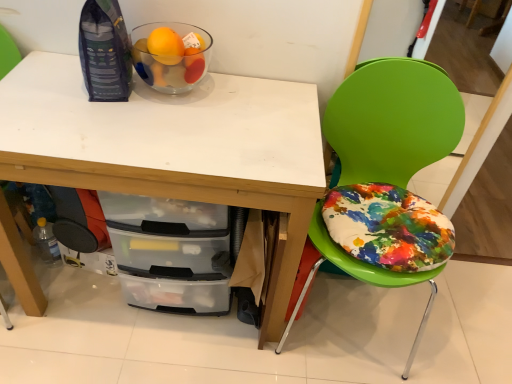
Question: Are clear plastic bottle at lower left and transparent glass bowl at upper left beside each other?

Choices:
 (A) no
 (B) yes

Answer: (A)

Question: From a real-world perspective, is clear plastic bottle at lower left physically above transparent glass bowl at upper left?

Choices:
 (A) no
 (B) yes

Answer: (A)

Question: Is clear plastic bottle at lower left surrounding transparent glass bowl at upper left?

Choices:
 (A) no
 (B) yes

Answer: (A)

Question: Could you tell me if clear plastic bottle at lower left is turned towards transparent glass bowl at upper left?

Choices:
 (A) no
 (B) yes

Answer: (A)

Question: Does clear plastic bottle at lower left have a lesser height compared to transparent glass bowl at upper left?

Choices:
 (A) no
 (B) yes

Answer: (A)

Question: From the image's perspective, is clear plastic bottle at lower left positioned above or below green plastic chair at right?

Choices:
 (A) below
 (B) above

Answer: (A)

Question: Is clear plastic bottle at lower left taller or shorter than green plastic chair at right?

Choices:
 (A) tall
 (B) short

Answer: (B)

Question: Based on their positions, is clear plastic bottle at lower left located to the left or right of green plastic chair at right?

Choices:
 (A) right
 (B) left

Answer: (B)

Question: Considering their positions, is clear plastic bottle at lower left located in front of or behind green plastic chair at right?

Choices:
 (A) behind
 (B) front

Answer: (A)

Question: Is green plastic chair at right spatially inside clear plastic bottle at lower left, or outside of it?

Choices:
 (A) outside
 (B) inside

Answer: (A)

Question: From a real-world perspective, is green plastic chair at right physically located above or below clear plastic bottle at lower left?

Choices:
 (A) above
 (B) below

Answer: (A)

Question: Is point (403, 185) closer or farther from the camera than point (37, 238)?

Choices:
 (A) farther
 (B) closer

Answer: (B)

Question: In the image, is green plastic chair at right positioned in front of or behind clear plastic bottle at lower left?

Choices:
 (A) behind
 (B) front

Answer: (B)

Question: Relative to white matte desk at upper center, is green plastic chair at right in front or behind?

Choices:
 (A) behind
 (B) front

Answer: (B)

Question: From their relative heights in the image, would you say green plastic chair at right is taller or shorter than white matte desk at upper center?

Choices:
 (A) short
 (B) tall

Answer: (B)